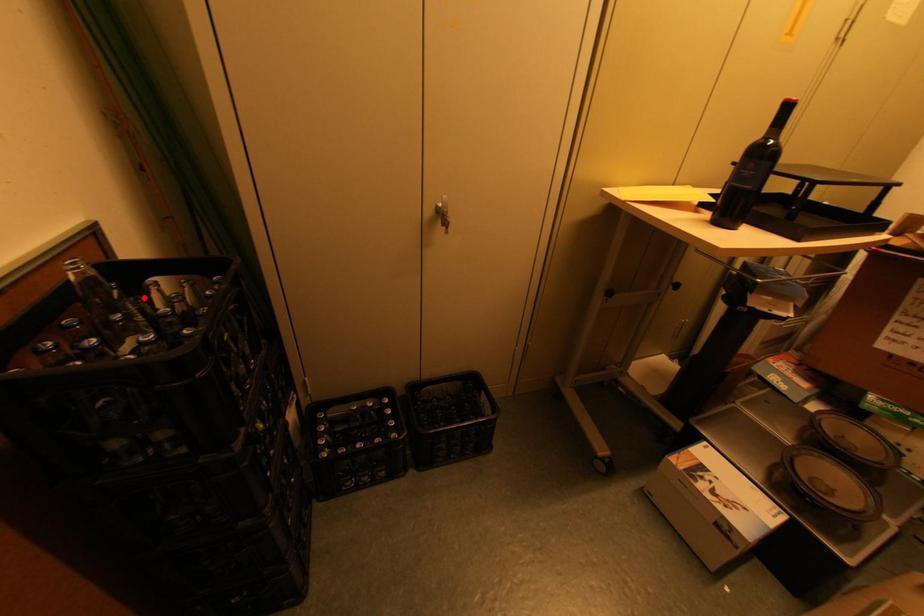
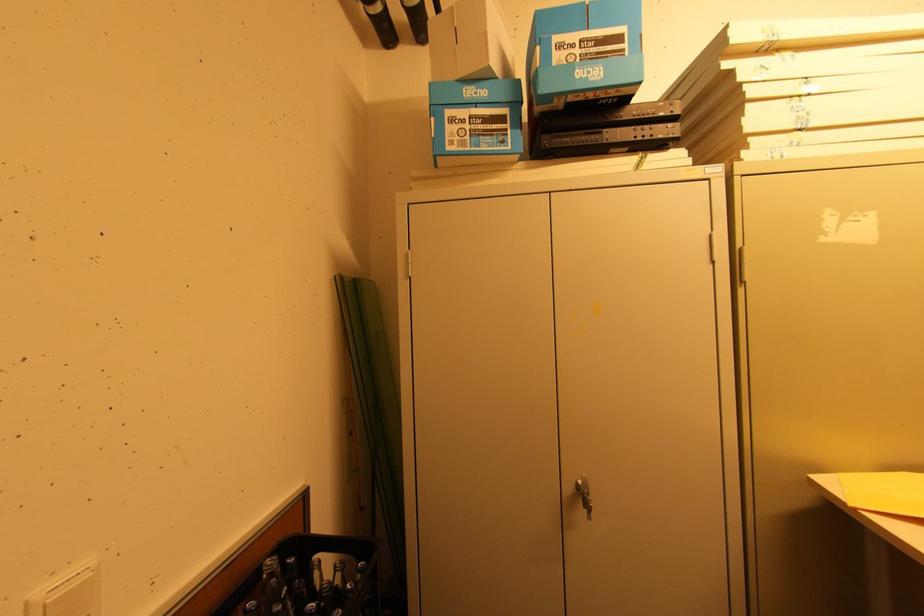
The point at the highlighted location is marked in the first image. Where is the corresponding point in the second image?

(306, 582)